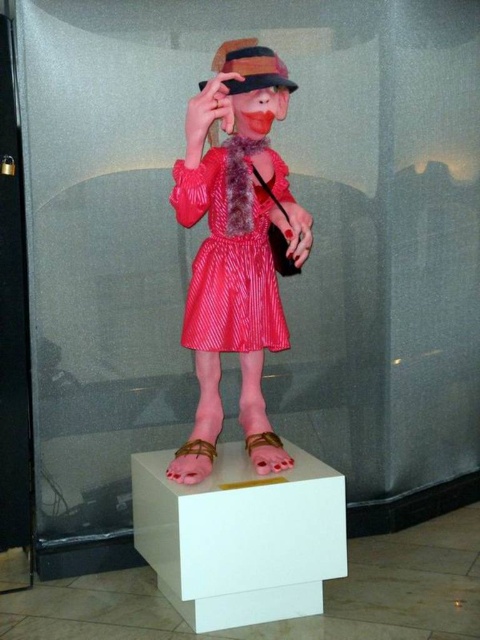
Question: Which of the following is the farthest from the observer?

Choices:
 (A) (254, 38)
 (B) (254, 396)
 (C) (205, 269)
 (D) (253, 534)

Answer: (A)

Question: Is shiny satin dress at center below pink matte sandal at lower center?

Choices:
 (A) no
 (B) yes

Answer: (A)

Question: Which object is closer to the camera taking this photo?

Choices:
 (A) shiny satin dress at center
 (B) shiny pink dress at center
 (C) pink matte sandal at lower center
 (D) leather at center

Answer: (B)

Question: Does shiny satin dress at center appear on the left side of striped felt hat at upper center?

Choices:
 (A) yes
 (B) no

Answer: (A)

Question: Estimate the real-world distances between objects in this image. Which object is farther from the shiny pink dress at center?

Choices:
 (A) pink matte sandal at lower center
 (B) white matte box at center

Answer: (A)

Question: Does white matte box at center appear under striped felt hat at upper center?

Choices:
 (A) no
 (B) yes

Answer: (B)